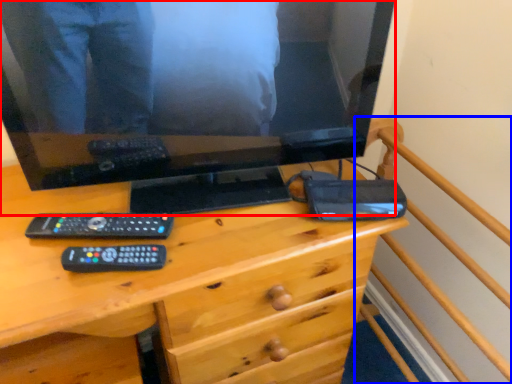
Question: Which object appears closest to the camera in this image, television (highlighted by a red box) or bed frame (highlighted by a blue box)?

Choices:
 (A) television
 (B) bed frame

Answer: (B)